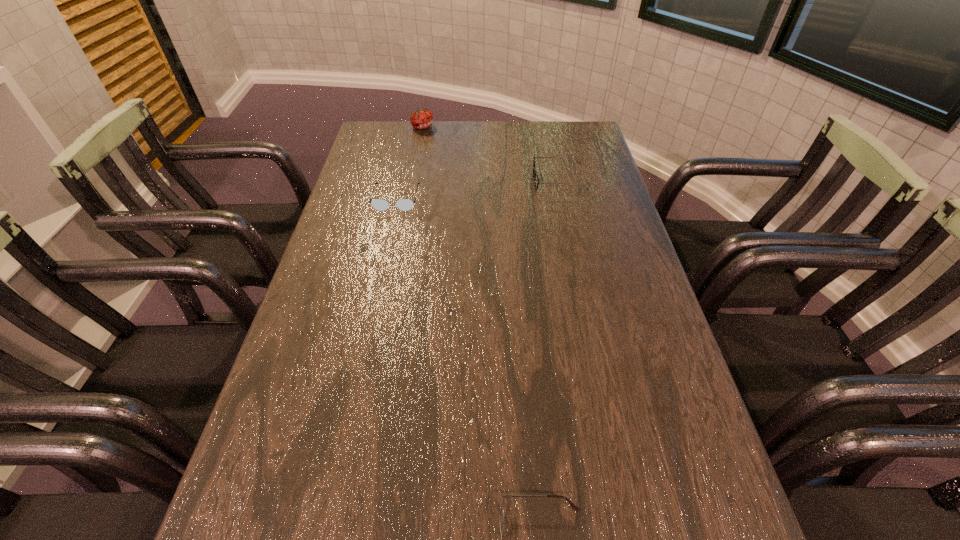
Find the location of a particular element. object that is at the far edge is located at coordinates (422, 118).

Locate an element on the screen. This screenshot has height=540, width=960. tomato at the left edge is located at coordinates (422, 118).

Locate an element on the screen. This screenshot has height=540, width=960. spectacles that is at the left edge is located at coordinates (378, 204).

The image size is (960, 540). I want to click on object located at the right edge, so click(536, 181).

The image size is (960, 540). In order to click on object that is at the far left corner in this screenshot , I will do click(x=422, y=118).

Where is `vacant space at the far edge of the desktop`? The width and height of the screenshot is (960, 540). vacant space at the far edge of the desktop is located at coordinates (443, 137).

Where is `vacant area at the left edge of the desktop`? vacant area at the left edge of the desktop is located at coordinates (330, 460).

You are a GUI agent. You are given a task and a screenshot of the screen. Output one action in this format:
    pyautogui.click(x=<x>, y=<y>)
    Task: Click on the vacant space at the right edge of the desktop
    
    Given the screenshot: What is the action you would take?
    pyautogui.click(x=582, y=204)

This screenshot has width=960, height=540. In the image, there is a desktop. Find the location of `vacant space at the far left corner`. vacant space at the far left corner is located at coordinates (406, 143).

Where is `free space between the second tallest spectacles and the tallest object`? The image size is (960, 540). free space between the second tallest spectacles and the tallest object is located at coordinates (410, 163).